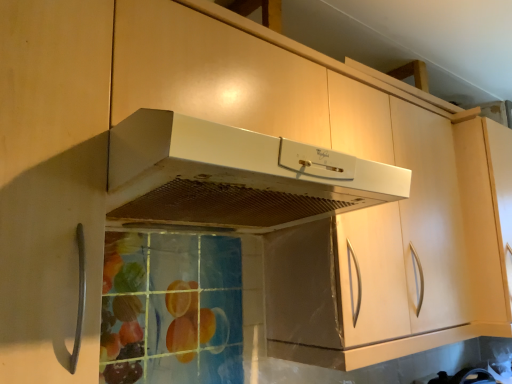
Question: Based on their sizes in the image, would you say white matte range hood at center is bigger or smaller than matte wood cabinet at upper right?

Choices:
 (A) small
 (B) big

Answer: (A)

Question: In terms of width, does white matte range hood at center look wider or thinner when compared to matte wood cabinet at upper right?

Choices:
 (A) thin
 (B) wide

Answer: (B)

Question: In the image, is white matte range hood at center positioned in front of or behind matte wood cabinet at upper right?

Choices:
 (A) front
 (B) behind

Answer: (A)

Question: From the image's perspective, is matte wood cabinet at upper right above or below white matte range hood at center?

Choices:
 (A) below
 (B) above

Answer: (A)

Question: In terms of width, does matte wood cabinet at upper right look wider or thinner when compared to white matte range hood at center?

Choices:
 (A) thin
 (B) wide

Answer: (A)

Question: From a real-world perspective, is matte wood cabinet at upper right positioned above or below white matte range hood at center?

Choices:
 (A) below
 (B) above

Answer: (A)

Question: Is matte wood cabinet at upper right situated inside white matte range hood at center or outside?

Choices:
 (A) outside
 (B) inside

Answer: (A)